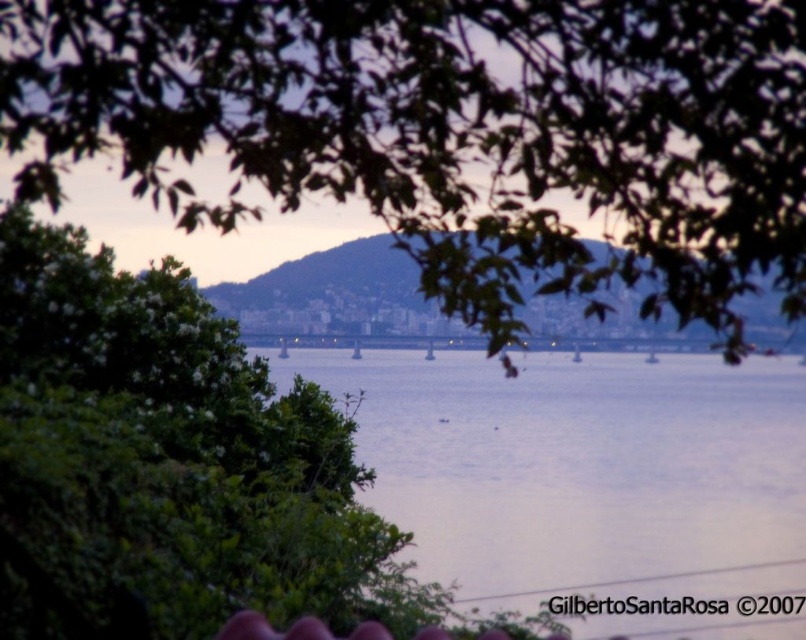
You are a photographer trying to capture the reflection of the boats in the water. Which boat, the white plastic boat at center or the smooth white boat at center, will have its reflection closer to the photographer?

The white plastic boat at center is above the smooth white boat at center, so its reflection will be closer to the photographer.

You are a photographer trying to capture the entire scene in one shot. Given that your camera can only focus on one main subject at a time, which object between the green leafy tree at upper center and the blue water at center should you choose to focus on to ensure it takes up more space in the photo?

The blue water at center should be focused on because it is larger than the green leafy tree at upper center, allowing it to occupy more space in the photo.

You are an artist planning to paint the waterfront scene. You want to ensure the green leafy tree at upper center and the blue water at center are proportionally accurate. Which object should you make wider in your painting?

The green leafy tree at upper center should be made wider in the painting since its width is larger than the blue water at center according to the description.